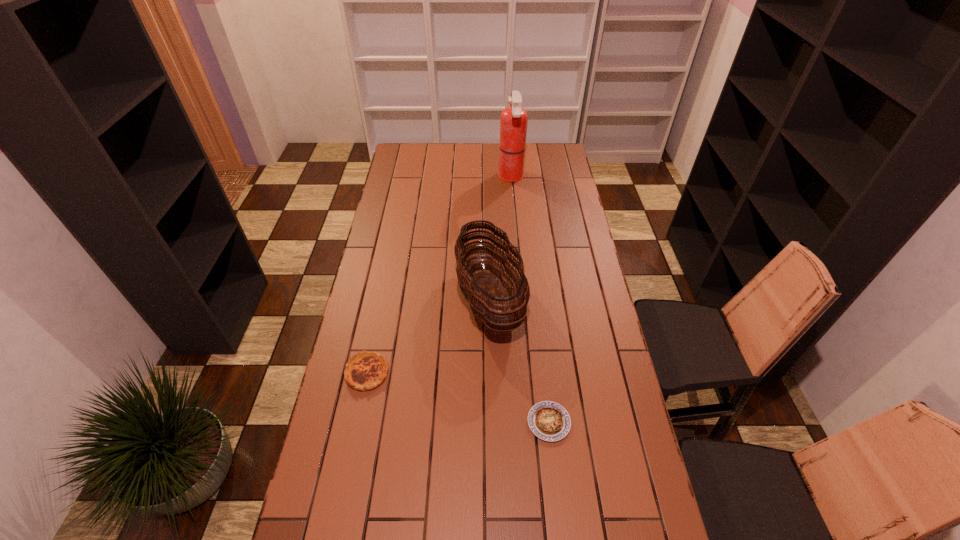
Image resolution: width=960 pixels, height=540 pixels. Find the location of `vacant space that satisfies the following two spatial constraints: 1. on the back side of the third farthest object; 2. on the left side of the basket`. vacant space that satisfies the following two spatial constraints: 1. on the back side of the third farthest object; 2. on the left side of the basket is located at coordinates (382, 300).